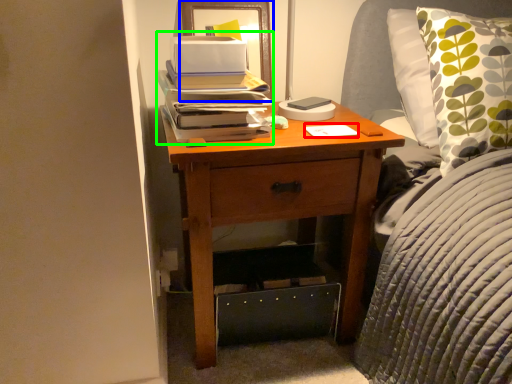
Question: Which object is the closest to the notepad (highlighted by a red box)? Choose among these: picture frame (highlighted by a blue box) or book (highlighted by a green box).

Choices:
 (A) picture frame
 (B) book

Answer: (B)